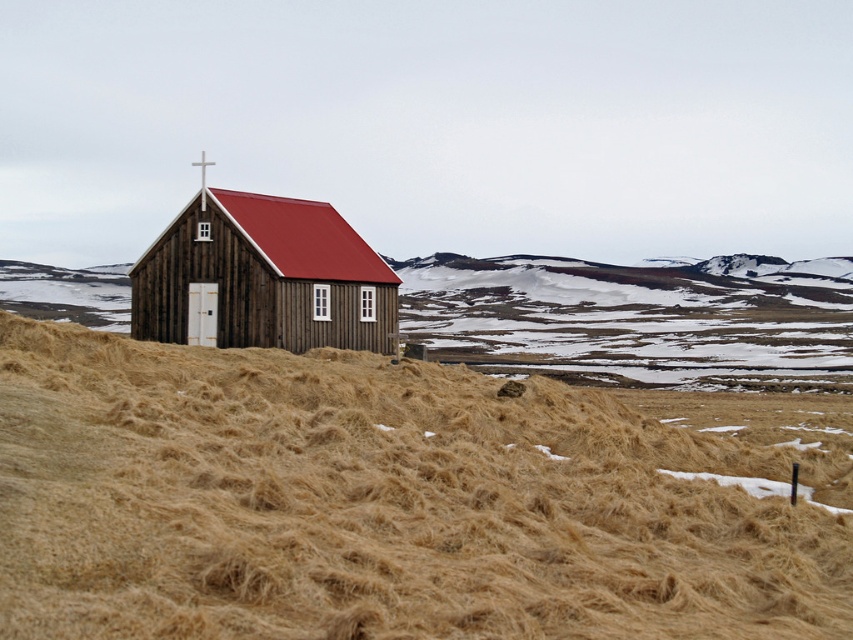
Which is in front, point (73, 388) or point (351, 234)?

Point (73, 388)

Is point (239, 499) positioned after point (293, 256)?

No, it is in front of (293, 256).

This screenshot has width=853, height=640. I want to click on brown dry grass at lower center, so click(x=381, y=502).

Locate an element on the screen. brown dry grass at lower center is located at coordinates (381, 502).